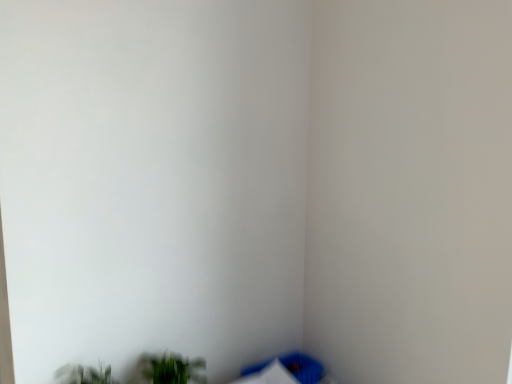
What do you see at coordinates (169, 370) in the screenshot? I see `green leafy plant at lower left` at bounding box center [169, 370].

In order to face green leafy plant at lower left, should I rotate leftwards or rightwards?

Turn left approximately 10.323 degrees to face it.

This screenshot has height=384, width=512. Identify the location of green leafy plant at lower left. (169, 370).

Find the location of `green leafy plant at lower left`. green leafy plant at lower left is located at coordinates (169, 370).